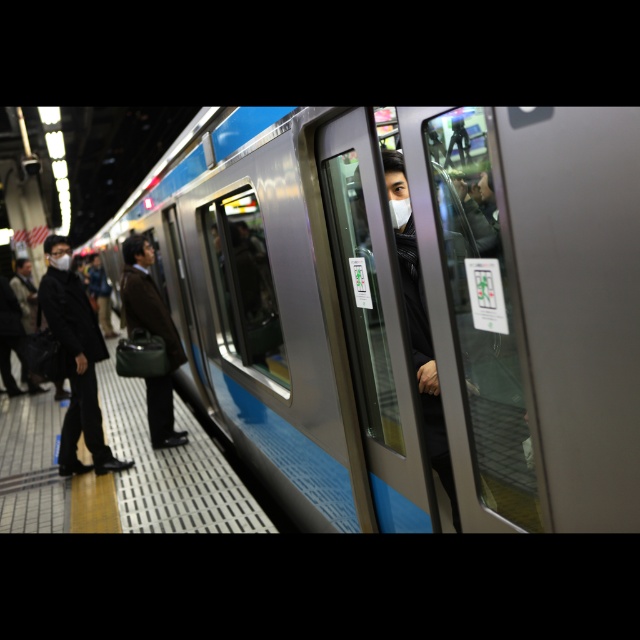
Question: Which of the following is the farthest from the observer?

Choices:
 (A) (148, 401)
 (B) (609, 371)

Answer: (A)

Question: Does black matte suit at left have a smaller size compared to matte brown coat at center?

Choices:
 (A) no
 (B) yes

Answer: (A)

Question: Where is metallic silver train at center located in relation to black matte suit at left in the image?

Choices:
 (A) right
 (B) left

Answer: (A)

Question: Observing the image, what is the correct spatial positioning of metallic silver train at center in reference to matte brown coat at center?

Choices:
 (A) below
 (B) above

Answer: (B)

Question: Which point appears closest to the camera in this image?

Choices:
 (A) (97, 400)
 (B) (170, 246)
 (C) (132, 317)

Answer: (A)

Question: Among these objects, which one is nearest to the camera?

Choices:
 (A) black matte suit at left
 (B) matte brown coat at center
 (C) metallic silver train at center

Answer: (C)